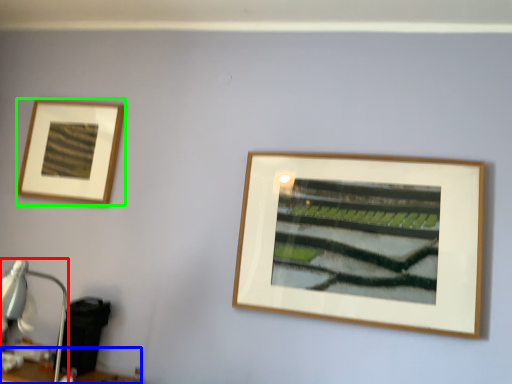
Question: Which is nearer to the table lamp (highlighted by a red box)? table (highlighted by a blue box) or picture frame (highlighted by a green box).

Choices:
 (A) table
 (B) picture frame

Answer: (A)